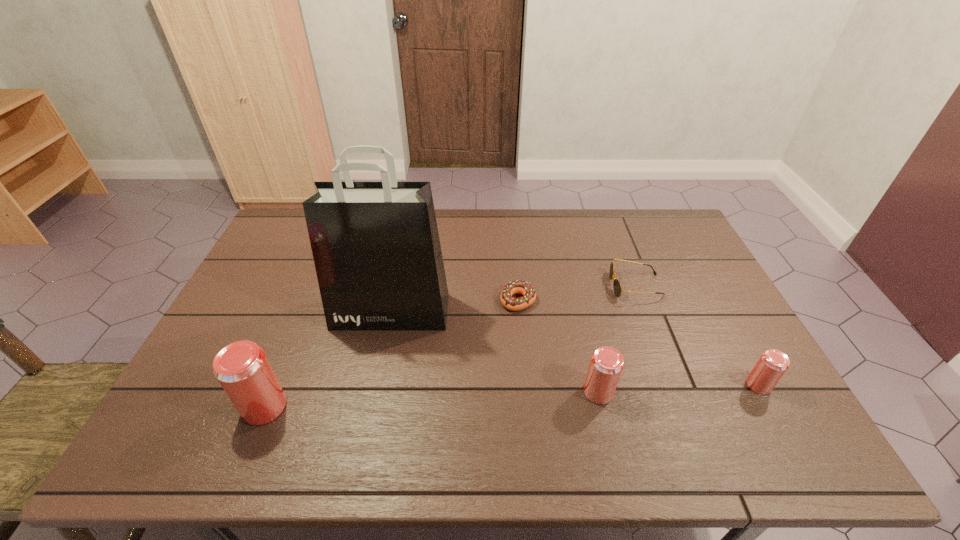
This screenshot has width=960, height=540. I want to click on the leftmost beer can, so click(242, 368).

I want to click on the tallest beer can, so click(242, 368).

Find the location of a particular element. This screenshot has width=960, height=540. the third object from right to left is located at coordinates (606, 365).

Image resolution: width=960 pixels, height=540 pixels. I want to click on the second tallest beer can, so click(x=606, y=365).

Identify the location of the rightmost object. (771, 366).

Identify the location of the fourth tallest object. This screenshot has height=540, width=960. (771, 366).

Image resolution: width=960 pixels, height=540 pixels. I want to click on the second object from left to right, so click(376, 248).

I want to click on the tallest object, so click(x=376, y=248).

You are a GUI agent. You are given a task and a screenshot of the screen. Output one action in this format:
    pyautogui.click(x=<x>, y=<y>)
    Task: Click on the sunglasses
    
    Given the screenshot: What is the action you would take?
    pyautogui.click(x=617, y=286)

The height and width of the screenshot is (540, 960). Find the location of `doughnut`. doughnut is located at coordinates (522, 287).